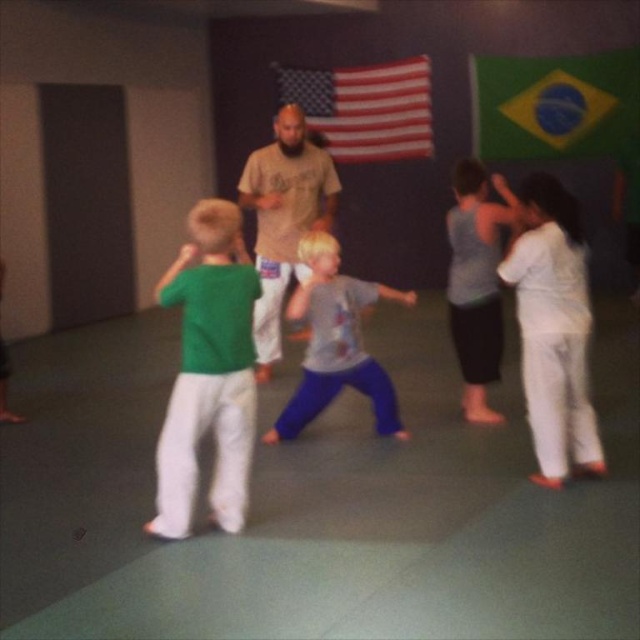
Question: Is green cotton shirt at left smaller than brown cotton shirt at center?

Choices:
 (A) yes
 (B) no

Answer: (A)

Question: Which of the following is the farthest from the observer?

Choices:
 (A) (250, 273)
 (B) (284, 141)
 (C) (355, 145)

Answer: (C)

Question: Which object is positioned farthest from the green cotton shirt at left?

Choices:
 (A) american flag at center
 (B) gray cotton shirt at center
 (C) brown cotton shirt at center

Answer: (A)

Question: Is brown cotton shirt at center bigger than gray cotton shirt at center?

Choices:
 (A) no
 (B) yes

Answer: (B)

Question: Which object appears closest to the camera in this image?

Choices:
 (A) brown cotton shirt at center
 (B) green cotton shirt at left

Answer: (B)

Question: Can you confirm if green cotton shirt at left is thinner than white cotton shirt at upper right?

Choices:
 (A) yes
 (B) no

Answer: (B)